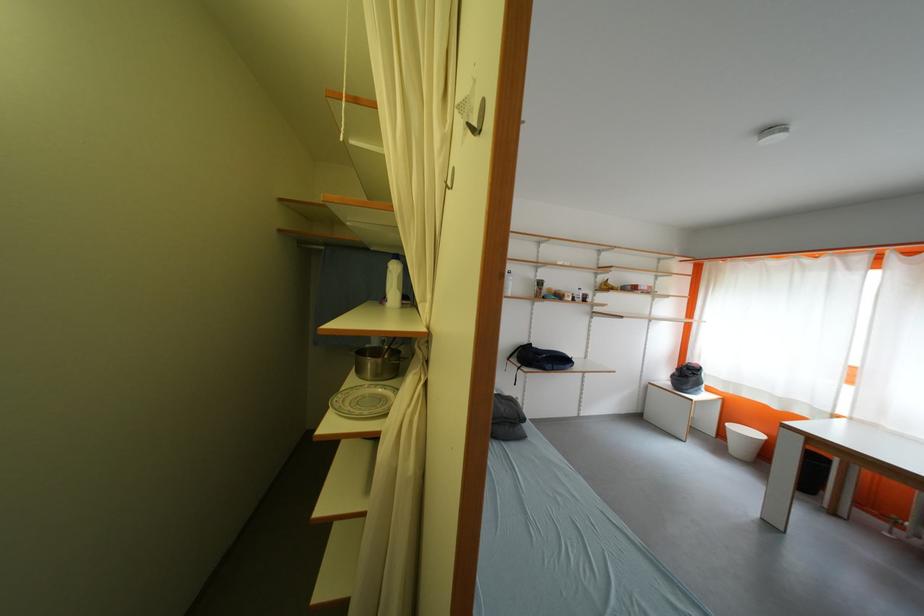
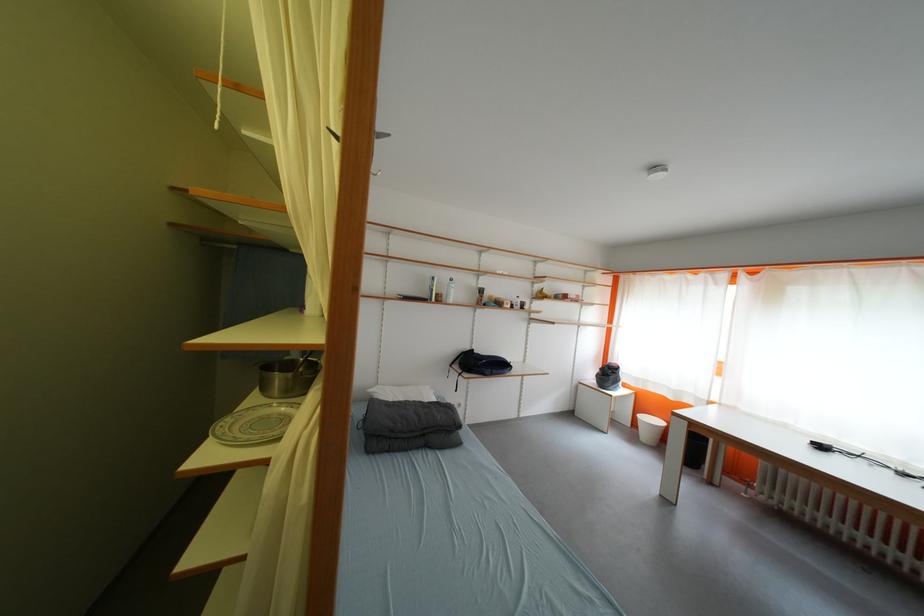
The point at (348,399) is marked in the first image. Where is the corresponding point in the second image?

(237, 422)